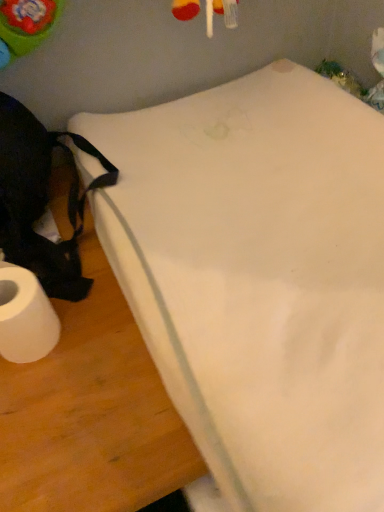
Question: Does white foam mattress at lower left appear on the right side of white matte toilet paper at lower left?

Choices:
 (A) no
 (B) yes

Answer: (B)

Question: Is white foam mattress at lower left outside white matte toilet paper at lower left?

Choices:
 (A) no
 (B) yes

Answer: (B)

Question: Is white foam mattress at lower left facing towards white matte toilet paper at lower left?

Choices:
 (A) yes
 (B) no

Answer: (B)

Question: From a real-world perspective, is white foam mattress at lower left on top of white matte toilet paper at lower left?

Choices:
 (A) yes
 (B) no

Answer: (A)

Question: From the image's perspective, is white foam mattress at lower left beneath white matte toilet paper at lower left?

Choices:
 (A) no
 (B) yes

Answer: (A)

Question: Is white foam mattress at lower left in front of white matte toilet paper at lower left?

Choices:
 (A) yes
 (B) no

Answer: (A)

Question: Is white matte toilet paper at lower left looking in the opposite direction of white foam mattress at lower left?

Choices:
 (A) yes
 (B) no

Answer: (B)

Question: Does white matte toilet paper at lower left have a lesser width compared to white foam mattress at lower left?

Choices:
 (A) yes
 (B) no

Answer: (A)

Question: Is white foam mattress at lower left inside white matte toilet paper at lower left?

Choices:
 (A) no
 (B) yes

Answer: (A)

Question: Can you confirm if white matte toilet paper at lower left is positioned to the right of white foam mattress at lower left?

Choices:
 (A) no
 (B) yes

Answer: (A)

Question: Considering the relative sizes of white matte toilet paper at lower left and white foam mattress at lower left in the image provided, is white matte toilet paper at lower left smaller than white foam mattress at lower left?

Choices:
 (A) yes
 (B) no

Answer: (A)

Question: Is white matte toilet paper at lower left facing towards white foam mattress at lower left?

Choices:
 (A) yes
 (B) no

Answer: (B)

Question: Is point (23, 346) positioned closer to the camera than point (193, 382)?

Choices:
 (A) farther
 (B) closer

Answer: (A)